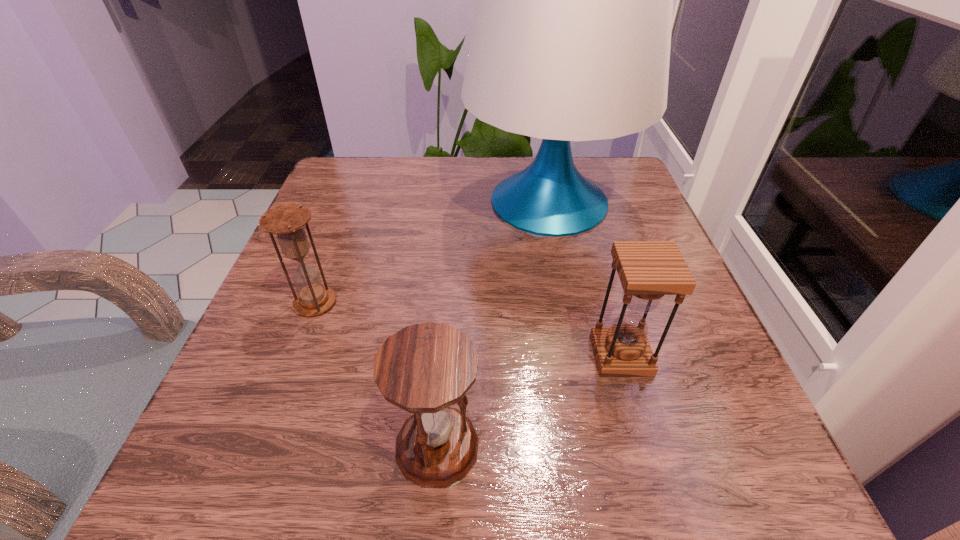
Where is `vacant space located 0.280m on the front-facing side of the tallest object`? The image size is (960, 540). vacant space located 0.280m on the front-facing side of the tallest object is located at coordinates (341, 202).

What are the coordinates of `vacant position located 0.090m on the left of the third farthest object` in the screenshot? It's located at (537, 355).

Image resolution: width=960 pixels, height=540 pixels. I want to click on vacant position located 0.270m on the right of the leftmost hourglass, so click(x=491, y=302).

Locate an element on the screen. This screenshot has width=960, height=540. vacant space located 0.290m on the right of the nearest hourglass is located at coordinates (699, 446).

This screenshot has width=960, height=540. Identify the location of object that is at the far edge. (571, 39).

Where is `object that is at the near edge`? The height and width of the screenshot is (540, 960). object that is at the near edge is located at coordinates pyautogui.click(x=425, y=368).

Find the location of a particular element. object present at the left edge is located at coordinates (287, 221).

Find the location of a particular element. table lamp that is positioned at the right edge is located at coordinates (571, 39).

What are the coordinates of `hourglass at the right edge` in the screenshot? It's located at click(648, 270).

The width and height of the screenshot is (960, 540). I want to click on object situated at the far right corner, so (x=571, y=39).